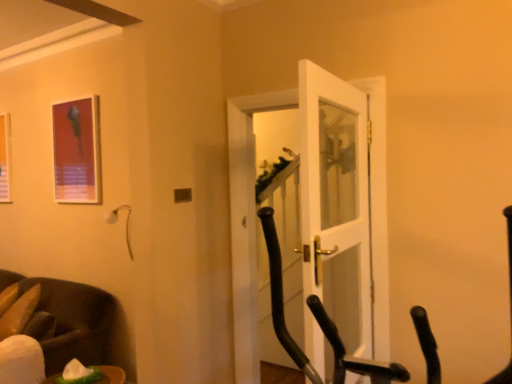
The image size is (512, 384). Describe the element at coordinates (77, 151) in the screenshot. I see `metallic frame at upper left, arranged as the first picture frame when viewed from the front` at that location.

In order to face dark brown leather chair at lower left, should I rotate leftwards or rightwards?

Turn left approximately 30.853 degrees to face it.

At what (x,y) coordinates should I click in order to perform the action: click on dark brown leather chair at lower left. Please return your answer as a coordinate pair (x, y). Looking at the image, I should click on (72, 319).

I want to click on white glossy door at center, so click(336, 202).

Considering the relative sizes of metallic frame at upper left, arranged as the first picture frame when viewed from the front, and matte plastic picture frame at upper left, placed as the 2th picture frame when sorted from right to left, in the image provided, is metallic frame at upper left, arranged as the first picture frame when viewed from the front, shorter than matte plastic picture frame at upper left, placed as the 2th picture frame when sorted from right to left,?

No, metallic frame at upper left, arranged as the first picture frame when viewed from the front, is not shorter than matte plastic picture frame at upper left, placed as the 2th picture frame when sorted from right to left.

From the image's perspective, which is below, metallic frame at upper left, placed as the second picture frame when sorted from left to right, or matte plastic picture frame at upper left, placed as the 2th picture frame when sorted from right to left?

matte plastic picture frame at upper left, placed as the 2th picture frame when sorted from right to left, from the image's perspective.

I want to click on picture frame on the left of metallic frame at upper left, placed as the second picture frame when sorted from left to right, so click(5, 158).

From the image's perspective, is matte plastic picture frame at upper left, placed as the 2th picture frame when sorted from front to back, located above or below white glossy door at center?

Clearly, from the image's perspective, matte plastic picture frame at upper left, placed as the 2th picture frame when sorted from front to back, is above white glossy door at center.

Considering the relative sizes of matte plastic picture frame at upper left, placed as the 2th picture frame when sorted from front to back, and white glossy door at center in the image provided, is matte plastic picture frame at upper left, placed as the 2th picture frame when sorted from front to back, shorter than white glossy door at center?

Correct, matte plastic picture frame at upper left, placed as the 2th picture frame when sorted from front to back, is not as tall as white glossy door at center.

From a real-world perspective, which is physically above, matte plastic picture frame at upper left, the 1th picture frame in the left-to-right sequence, or white glossy door at center?

matte plastic picture frame at upper left, the 1th picture frame in the left-to-right sequence, from a real-world perspective.

Is the position of matte plastic picture frame at upper left, placed as the 2th picture frame when sorted from front to back, more distant than that of white glossy door at center?

That is True.

From a real-world perspective, who is located lower, white glossy door at center or dark brown leather chair at lower left?

dark brown leather chair at lower left is physically lower.

Is point (336, 323) closer to camera compared to point (95, 315)?

Yes, point (336, 323) is in front of point (95, 315).

Who is taller, white glossy door at center or dark brown leather chair at lower left?

With more height is white glossy door at center.

Is white glossy door at center looking in the opposite direction of dark brown leather chair at lower left?

No, white glossy door at center is not facing away from dark brown leather chair at lower left.

In the scene shown: Is matte plastic picture frame at upper left, the 1th picture frame in the left-to-right sequence, further to camera compared to black rubber exercise bike at center?

Yes, it is behind black rubber exercise bike at center.

Is matte plastic picture frame at upper left, the 1th picture frame in the left-to-right sequence, completely or partially outside of black rubber exercise bike at center?

Yes, matte plastic picture frame at upper left, the 1th picture frame in the left-to-right sequence, is located beyond the bounds of black rubber exercise bike at center.

How different are the orientations of matte plastic picture frame at upper left, the 1th picture frame in the left-to-right sequence, and black rubber exercise bike at center in degrees?

2.22 degrees separate the facing orientations of matte plastic picture frame at upper left, the 1th picture frame in the left-to-right sequence, and black rubber exercise bike at center.

Considering the points (325, 137) and (324, 328), which point is in front, point (325, 137) or point (324, 328)?

The point (324, 328) is closer to the camera.

Does white glossy door at center have a smaller size compared to black rubber exercise bike at center?

Yes, white glossy door at center is smaller than black rubber exercise bike at center.

Is white glossy door at center oriented away from black rubber exercise bike at center?

Yes, black rubber exercise bike at center is at the back of white glossy door at center.

In the image, is white glossy door at center positioned in front of or behind black rubber exercise bike at center?

Clearly, white glossy door at center is behind black rubber exercise bike at center.

From a real-world perspective, which is physically below, metallic frame at upper left, which is counted as the second picture frame, starting from the back, or black rubber exercise bike at center?

In real-world perspective, black rubber exercise bike at center is lower.

Is metallic frame at upper left, which ranks as the first picture frame in right-to-left order, to the left of black rubber exercise bike at center from the viewer's perspective?

Correct, you'll find metallic frame at upper left, which ranks as the first picture frame in right-to-left order, to the left of black rubber exercise bike at center.

Between point (82, 124) and point (272, 311), which one is positioned in front?

The point (272, 311) is more forward.

Is white glossy door at center completely or partially outside of metallic frame at upper left, which ranks as the first picture frame in right-to-left order?

Yes, white glossy door at center is located beyond the bounds of metallic frame at upper left, which ranks as the first picture frame in right-to-left order.

Looking at this image, considering the relative positions of white glossy door at center and metallic frame at upper left, placed as the second picture frame when sorted from left to right, in the image provided, is white glossy door at center behind metallic frame at upper left, placed as the second picture frame when sorted from left to right,?

No, white glossy door at center is in front of metallic frame at upper left, placed as the second picture frame when sorted from left to right.

Considering the relative sizes of white glossy door at center and metallic frame at upper left, which is counted as the second picture frame, starting from the back, in the image provided, is white glossy door at center smaller than metallic frame at upper left, which is counted as the second picture frame, starting from the back,?

Actually, white glossy door at center might be larger than metallic frame at upper left, which is counted as the second picture frame, starting from the back.

In the scene shown: Which point is more distant from viewer, (x=334, y=208) or (x=62, y=152)?

Positioned behind is point (x=62, y=152).

Identify the location of picture frame on the left of the metallic frame at upper left, which is counted as the second picture frame, starting from the back. This screenshot has width=512, height=384. (5, 158).

There is a white glossy door at center. Where is `the 1st picture frame above it (from the image's perspective)`? the 1st picture frame above it (from the image's perspective) is located at coordinates (5, 158).

Based on their spatial positions, is black rubber exercise bike at center or white glossy door at center closer to dark brown leather chair at lower left?

white glossy door at center is closer to dark brown leather chair at lower left.

Looking at the image, which one is located further to metallic frame at upper left, which is counted as the second picture frame, starting from the back, black rubber exercise bike at center or white glossy door at center?

black rubber exercise bike at center lies further to metallic frame at upper left, which is counted as the second picture frame, starting from the back, than the other object.

Estimate the real-world distances between objects in this image. Which object is further from matte plastic picture frame at upper left, placed as the 2th picture frame when sorted from right to left, black rubber exercise bike at center or metallic frame at upper left, which ranks as the first picture frame in right-to-left order?

Based on the image, black rubber exercise bike at center appears to be further to matte plastic picture frame at upper left, placed as the 2th picture frame when sorted from right to left.

When comparing their distances from dark brown leather chair at lower left, does matte plastic picture frame at upper left, placed as the 2th picture frame when sorted from right to left, or black rubber exercise bike at center seem closer?

The object closer to dark brown leather chair at lower left is matte plastic picture frame at upper left, placed as the 2th picture frame when sorted from right to left.

Which object lies nearer to the anchor point black rubber exercise bike at center, white glossy door at center or metallic frame at upper left, which ranks as the first picture frame in right-to-left order?

white glossy door at center is positioned closer to the anchor black rubber exercise bike at center.

When comparing their distances from black rubber exercise bike at center, does metallic frame at upper left, which ranks as the first picture frame in right-to-left order, or white glossy door at center seem closer?

white glossy door at center.

Considering their positions, is white glossy door at center positioned closer to matte plastic picture frame at upper left, placed as the 2th picture frame when sorted from right to left, than dark brown leather chair at lower left?

Based on the image, dark brown leather chair at lower left appears to be nearer to matte plastic picture frame at upper left, placed as the 2th picture frame when sorted from right to left.

Looking at this image, estimate the real-world distances between objects in this image. Which object is further from dark brown leather chair at lower left, metallic frame at upper left, which is counted as the second picture frame, starting from the back, or black rubber exercise bike at center?

Based on the image, black rubber exercise bike at center appears to be further to dark brown leather chair at lower left.

What are the coordinates of `chair between matte plastic picture frame at upper left, acting as the first picture frame starting from the back, and black rubber exercise bike at center, in the horizontal direction` in the screenshot? It's located at (72, 319).

This screenshot has height=384, width=512. Identify the location of picture frame between black rubber exercise bike at center and matte plastic picture frame at upper left, acting as the first picture frame starting from the back, along the z-axis. (77, 151).

The height and width of the screenshot is (384, 512). I want to click on door located between black rubber exercise bike at center and metallic frame at upper left, placed as the second picture frame when sorted from left to right, in the depth direction, so click(336, 202).

Where is `chair located between matte plastic picture frame at upper left, placed as the 2th picture frame when sorted from right to left, and white glossy door at center in the left-right direction`? The height and width of the screenshot is (384, 512). chair located between matte plastic picture frame at upper left, placed as the 2th picture frame when sorted from right to left, and white glossy door at center in the left-right direction is located at coordinates (72, 319).